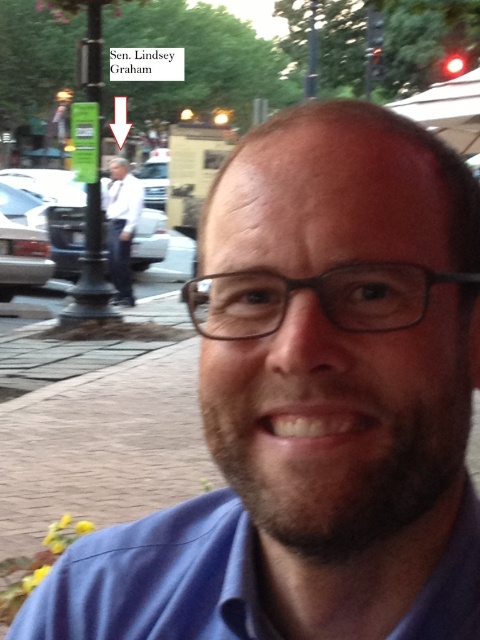
Question: Which point appears farthest from the camera in this image?

Choices:
 (A) (123, 212)
 (B) (233, 618)

Answer: (A)

Question: Does blue cotton dress shirt at center appear under white shirt at left?

Choices:
 (A) yes
 (B) no

Answer: (A)

Question: Can you confirm if blue cotton dress shirt at center is thinner than white shirt at left?

Choices:
 (A) yes
 (B) no

Answer: (A)

Question: In this image, where is blue cotton dress shirt at center located relative to white shirt at left?

Choices:
 (A) below
 (B) above

Answer: (A)

Question: Which object is farther from the camera taking this photo?

Choices:
 (A) blue cotton dress shirt at center
 (B) white shirt at left

Answer: (B)